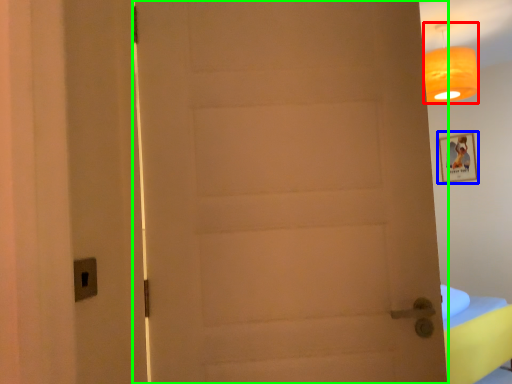
Question: Which is nearer to the lamp (highlighted by a red box)? picture frame (highlighted by a blue box) or door (highlighted by a green box).

Choices:
 (A) picture frame
 (B) door

Answer: (A)